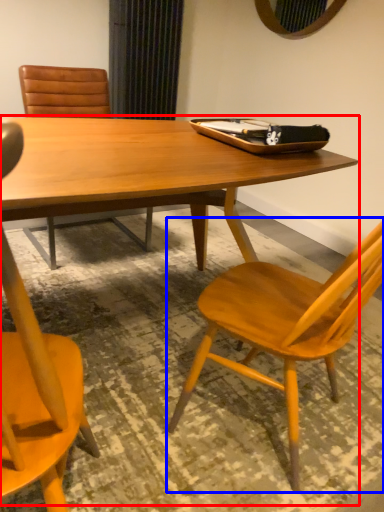
Question: Which object appears farthest to the camera in this image, round table (highlighted by a red box) or chair (highlighted by a blue box)?

Choices:
 (A) round table
 (B) chair

Answer: (A)